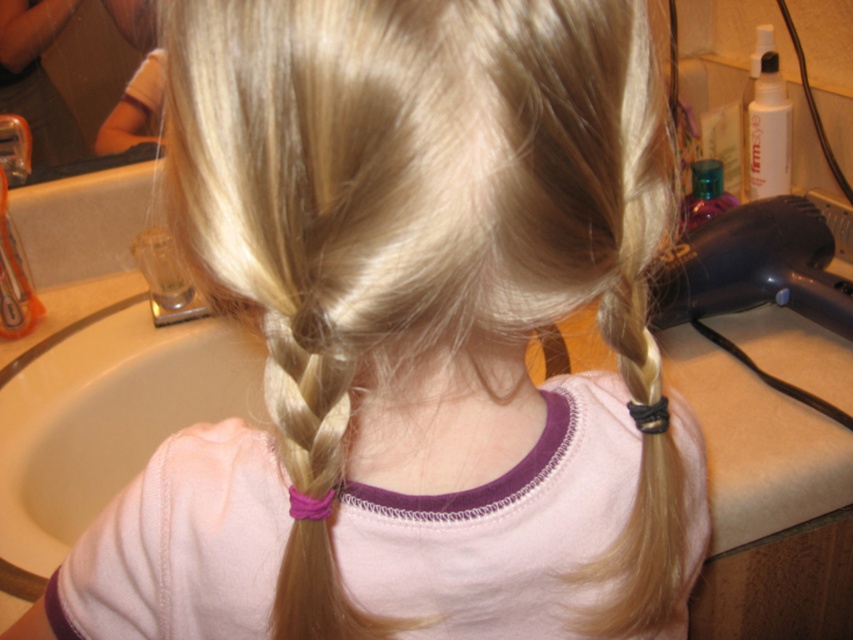
Question: Is black plastic hair dryer at right smaller than brushed metal faucet at upper left?

Choices:
 (A) yes
 (B) no

Answer: (B)

Question: Among these objects, which one is nearest to the camera?

Choices:
 (A) black plastic hair dryer at right
 (B) brushed metal faucet at upper left

Answer: (A)

Question: Can you confirm if black plastic hair dryer at right is thinner than brushed metal faucet at upper left?

Choices:
 (A) no
 (B) yes

Answer: (A)

Question: Which point appears farthest from the camera in this image?

Choices:
 (A) (788, 260)
 (B) (24, 168)

Answer: (B)

Question: Is black plastic hair dryer at right thinner than brushed metal faucet at upper left?

Choices:
 (A) no
 (B) yes

Answer: (A)